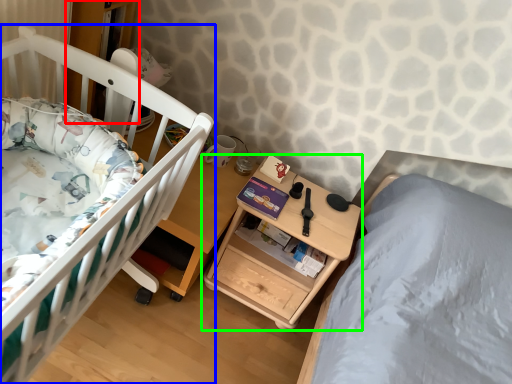
Question: Considering the real-world distances, which object is closest to bookshelf (highlighted by a red box)? infant bed (highlighted by a blue box) or nightstand (highlighted by a green box).

Choices:
 (A) infant bed
 (B) nightstand

Answer: (A)